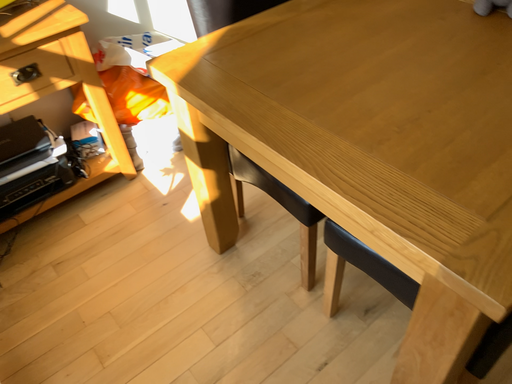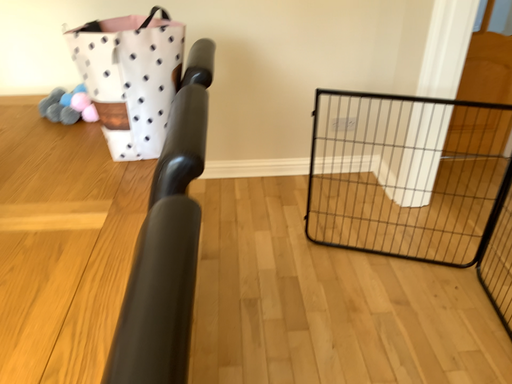
Question: Which way did the camera rotate in the video?

Choices:
 (A) rotated upward
 (B) rotated downward

Answer: (A)